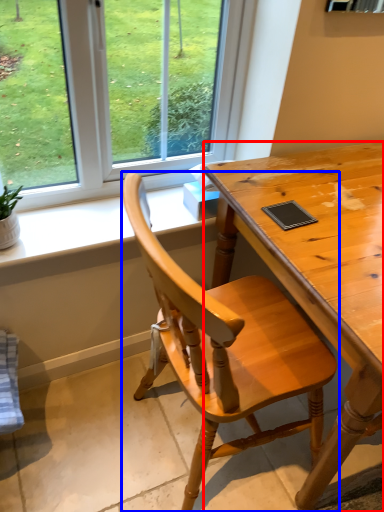
Question: Among these objects, which one is nearest to the camera, desk (highlighted by a red box) or chair (highlighted by a blue box)?

Choices:
 (A) desk
 (B) chair

Answer: (B)